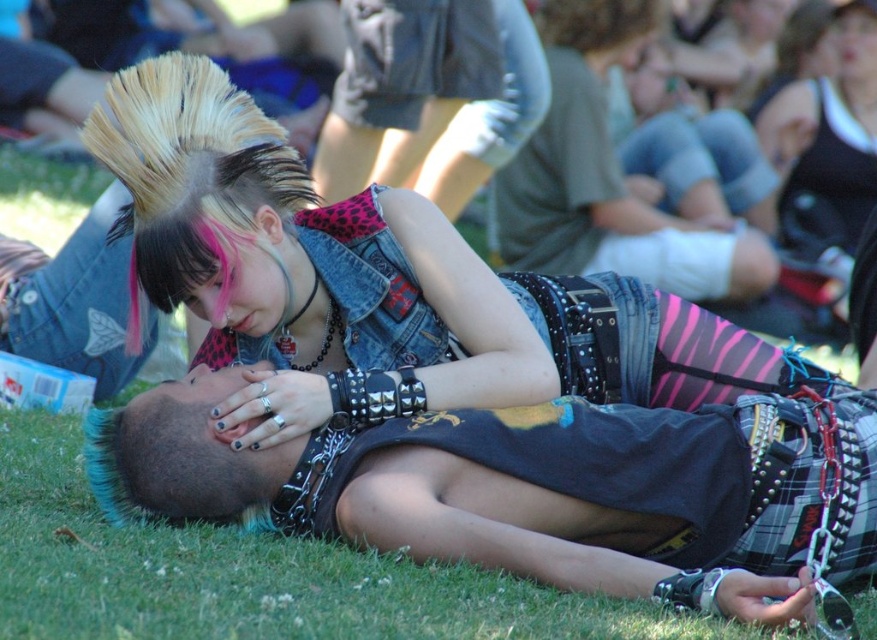
Is point (523, 307) positioned in front of point (656, 209)?

Yes, point (523, 307) is in front of point (656, 209).

Who is positioned more to the right, denim vest at center or denim shorts at center?

denim shorts at center is more to the right.

Between point (522, 288) and point (768, 273), which one is positioned behind?

Point (768, 273)

Where is `denim vest at center`? The width and height of the screenshot is (877, 640). denim vest at center is located at coordinates (330, 275).

Can you confirm if dark gray fabric shirt at center is smaller than denim vest at center?

Yes, dark gray fabric shirt at center is smaller than denim vest at center.

Is dark gray fabric shirt at center thinner than denim vest at center?

Correct, dark gray fabric shirt at center's width is less than denim vest at center's.

Locate an element on the screen. Image resolution: width=877 pixels, height=640 pixels. dark gray fabric shirt at center is located at coordinates (522, 490).

Can you confirm if dark gray fabric shirt at center is positioned to the right of denim shorts at center?

Incorrect, dark gray fabric shirt at center is not on the right side of denim shorts at center.

Find the location of `dark gray fabric shirt at center`. dark gray fabric shirt at center is located at coordinates (522, 490).

This screenshot has width=877, height=640. Identify the location of dark gray fabric shirt at center. (522, 490).